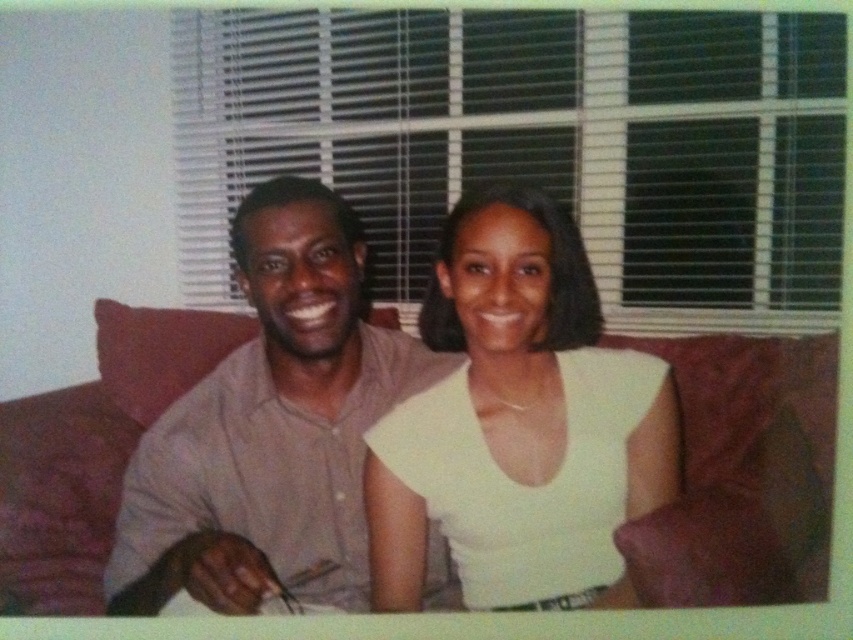
You are planning to rearrange the living room and want to place a new coffee table between the brown leather couch at center and the matte gray shirt at center. Which object should the coffee table be closer to, based on their sizes?

The coffee table should be closer to the matte gray shirt at center because the brown leather couch at center occupies less space, meaning the matte gray shirt at center is larger and would require more space between them.

In the scene shown: You are a photographer trying to capture a closeup of the brown leather couch at center. Given that the camera can only focus on objects within a 0.5 meter radius, will the point at coordinates (743, 474) be within the focus range?

The point at coordinates (743, 474) corresponds to the brown leather couch at center, so yes, the camera will focus on the brown leather couch at center since the point is within the focus range of 0.5 meters.

You are standing in the room and want to place a small plant between the two points, point (515, 509) and point (357, 339). To ensure the plant is closer to the front of the room, where should you place it?

You should place the plant closer to point (515, 509) because it is in front of point (357, 339).